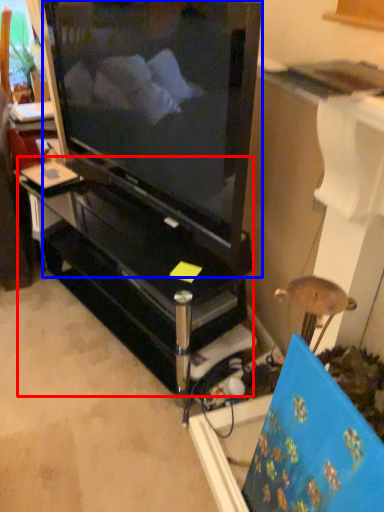
Question: Which point is further to the camera, furniture (highlighted by a red box) or television (highlighted by a blue box)?

Choices:
 (A) furniture
 (B) television

Answer: (A)